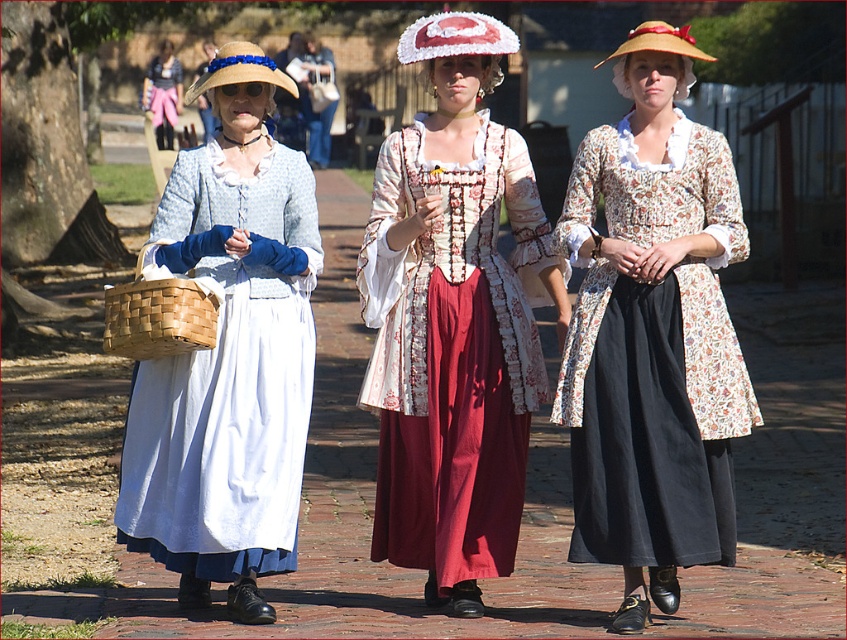
Between natural woven basket at left and straw hat at center, which one is positioned lower?

natural woven basket at left is lower down.

Does point (120, 346) lie in front of point (689, 65)?

Yes, point (120, 346) is closer to viewer.

Locate an element on the screen. natural woven basket at left is located at coordinates (158, 316).

Does point (430, 342) come farther from viewer compared to point (219, 68)?

Yes.

Which is more to the left, floral fabric dress at center or straw hat with blue ribbon at left?

straw hat with blue ribbon at left is more to the left.

Which is behind, point (469, 518) or point (191, 88)?

Positioned behind is point (191, 88).

Identify the location of floral fabric dress at center. This screenshot has height=640, width=847. (454, 320).

The width and height of the screenshot is (847, 640). I want to click on straw hat at center, so click(657, 51).

Does point (648, 45) come farther from viewer compared to point (219, 81)?

No, it is not.

Where is `straw hat at center`? straw hat at center is located at coordinates (657, 51).